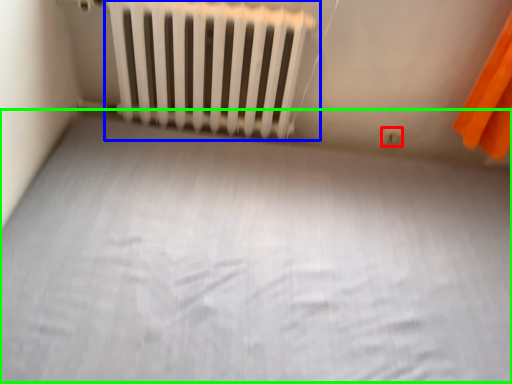
Question: Which is farther away from electric outlet (highlighted by a red box)? radiator (highlighted by a blue box) or bed frame (highlighted by a green box)?

Choices:
 (A) radiator
 (B) bed frame

Answer: (B)